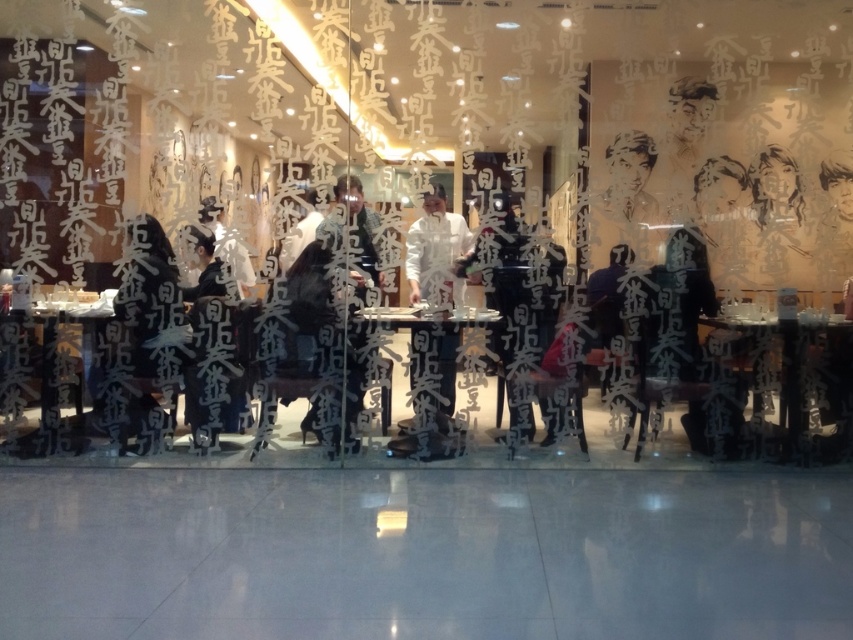
You are a customer entering the restaurant and see two points marked in the image. The first point is at coordinate point (833, 401) and the second is at coordinate point (180, 324). Which point is closer to you as you enter the restaurant?

Point (180, 324) is closer to you as you enter the restaurant because point (833, 401) is behind it.

You are a guest at this restaurant and want to place your black matte jacket at left on the transparent glass table at lower right. Will the jacket fit on the table?

The transparent glass table at lower right is shorter than black matte jacket at left, so the jacket may not fit properly on the table due to the table being shorter in height than the jacket.

You are a customer in the restaurant and you want to place your phone on the transparent glass table at lower right. However, you notice that the glass table is reflecting the Chinese characters on the wall behind it. Where would the reflection of the point at coordinate point (788, 378) on the glass table appear?

The reflection of the point at coordinate point (788, 378) on the glass table would appear directly below the original point, at the same horizontal position but mirrored vertically. Since the glass table is reflecting the Chinese characters on the wall behind it, the reflection would be located at coordinate point 0.592, 0.075.